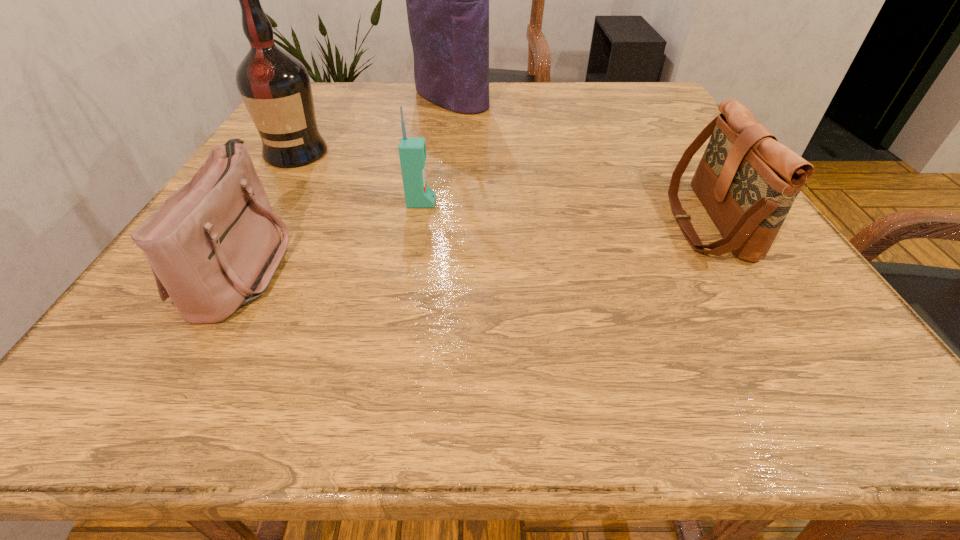
Where is `free space at the left edge of the desktop`? The height and width of the screenshot is (540, 960). free space at the left edge of the desktop is located at coordinates click(299, 210).

Locate an element on the screen. This screenshot has width=960, height=540. blank space at the right edge of the desktop is located at coordinates (678, 138).

The height and width of the screenshot is (540, 960). Find the location of `free region at the near left corner of the desktop`. free region at the near left corner of the desktop is located at coordinates (190, 369).

Identify the location of vacant area that lies between the farthest object and the left shoulder bag. (348, 183).

Image resolution: width=960 pixels, height=540 pixels. Find the location of `vacant area between the tallest object and the left shoulder bag`. vacant area between the tallest object and the left shoulder bag is located at coordinates (348, 183).

Where is `vacant space that is in between the cellular telephone and the rightmost object`? The image size is (960, 540). vacant space that is in between the cellular telephone and the rightmost object is located at coordinates (564, 212).

You are a GUI agent. You are given a task and a screenshot of the screen. Output one action in this format:
    pyautogui.click(x=<x>, y=<y>)
    Task: Click on the free space that is in between the left shoulder bag and the rightmost object
    This screenshot has width=960, height=540.
    Given the screenshot: What is the action you would take?
    pyautogui.click(x=475, y=244)

This screenshot has height=540, width=960. In order to click on empty space between the farthest object and the left shoulder bag in this screenshot , I will do click(348, 183).

You are a GUI agent. You are given a task and a screenshot of the screen. Output one action in this format:
    pyautogui.click(x=<x>, y=<y>)
    Task: Click on the vacant point located between the cellular telephone and the farthest object
    
    Given the screenshot: What is the action you would take?
    pyautogui.click(x=436, y=151)

You are a GUI agent. You are given a task and a screenshot of the screen. Output one action in this format:
    pyautogui.click(x=<x>, y=<y>)
    Task: Click on the empty space that is in between the left shoulder bag and the right shoulder bag
    Image resolution: width=960 pixels, height=540 pixels.
    Given the screenshot: What is the action you would take?
    pyautogui.click(x=475, y=244)